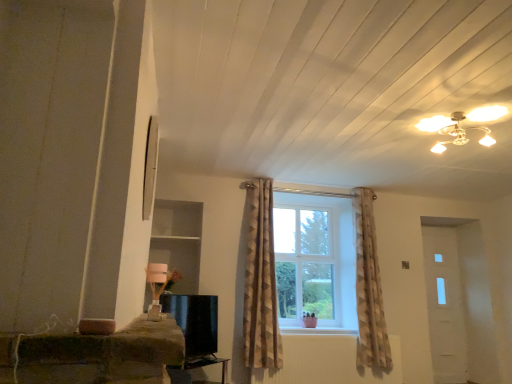
Question: Is black glossy tv at lower center not inside brown textured curtain at center?

Choices:
 (A) no
 (B) yes

Answer: (B)

Question: Considering the relative sizes of black glossy tv at lower center and brown textured curtain at center in the image provided, is black glossy tv at lower center bigger than brown textured curtain at center?

Choices:
 (A) no
 (B) yes

Answer: (A)

Question: Is black glossy tv at lower center turned away from brown textured curtain at center?

Choices:
 (A) yes
 (B) no

Answer: (B)

Question: From the image's perspective, would you say black glossy tv at lower center is shown under brown textured curtain at center?

Choices:
 (A) no
 (B) yes

Answer: (B)

Question: Can you confirm if black glossy tv at lower center is taller than brown textured curtain at center?

Choices:
 (A) no
 (B) yes

Answer: (A)

Question: Considering their positions, is black glossy tv at lower center located in front of or behind brown textured curtain at center?

Choices:
 (A) behind
 (B) front

Answer: (B)

Question: Is black glossy tv at lower center bigger or smaller than brown textured curtain at center?

Choices:
 (A) small
 (B) big

Answer: (A)

Question: From a real-world perspective, is black glossy tv at lower center above or below brown textured curtain at center?

Choices:
 (A) below
 (B) above

Answer: (A)

Question: From the image's perspective, is black glossy tv at lower center positioned above or below brown textured curtain at center?

Choices:
 (A) above
 (B) below

Answer: (B)

Question: Visually, is black glossy tv stand at lower center positioned to the left or to the right of brown textured curtain at center?

Choices:
 (A) left
 (B) right

Answer: (A)

Question: Relative to brown textured curtain at center, is black glossy tv stand at lower center in front or behind?

Choices:
 (A) front
 (B) behind

Answer: (A)

Question: Looking at the image, does black glossy tv stand at lower center seem bigger or smaller compared to brown textured curtain at center?

Choices:
 (A) big
 (B) small

Answer: (B)

Question: Does point (215, 360) appear closer or farther from the camera than point (276, 364)?

Choices:
 (A) closer
 (B) farther

Answer: (A)

Question: Looking at the image, does brown textured curtain at center seem bigger or smaller compared to black glossy tv stand at lower center?

Choices:
 (A) small
 (B) big

Answer: (B)

Question: From a real-world perspective, is brown textured curtain at center physically located above or below black glossy tv stand at lower center?

Choices:
 (A) below
 (B) above

Answer: (B)